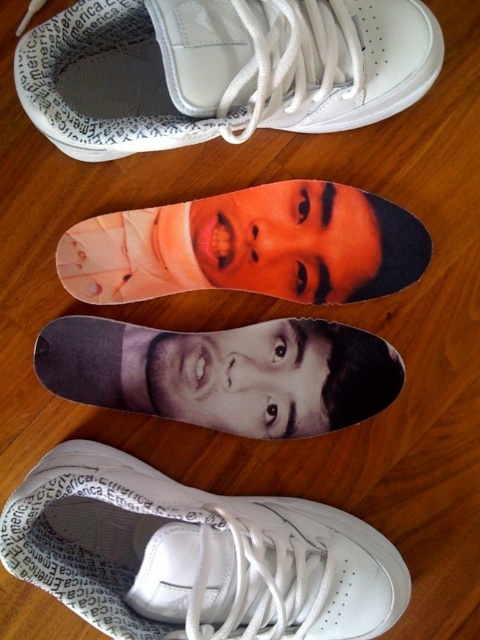
Question: Estimate the real-world distances between objects in this image. Which object is closer to the matte orange face at center?

Choices:
 (A) gray matte face at center
 (B) orange matte face at center
 (C) black matte selfie at center
 (D) white leather shoe at lower center

Answer: (B)

Question: Can you confirm if white leather shoe at lower center is positioned to the right of matte orange face at center?

Choices:
 (A) no
 (B) yes

Answer: (A)

Question: Which object is closer to the camera taking this photo?

Choices:
 (A) matte orange face at center
 (B) white leather shoe at upper center
 (C) gray matte face at center
 (D) orange matte face at center

Answer: (B)

Question: Does matte orange face at center appear on the left side of orange matte face at center?

Choices:
 (A) yes
 (B) no

Answer: (A)

Question: Which object is positioned farthest from the white leather shoe at upper center?

Choices:
 (A) black matte selfie at center
 (B) white leather shoe at lower center
 (C) matte orange face at center

Answer: (B)

Question: Is black matte selfie at center bigger than gray matte face at center?

Choices:
 (A) no
 (B) yes

Answer: (B)